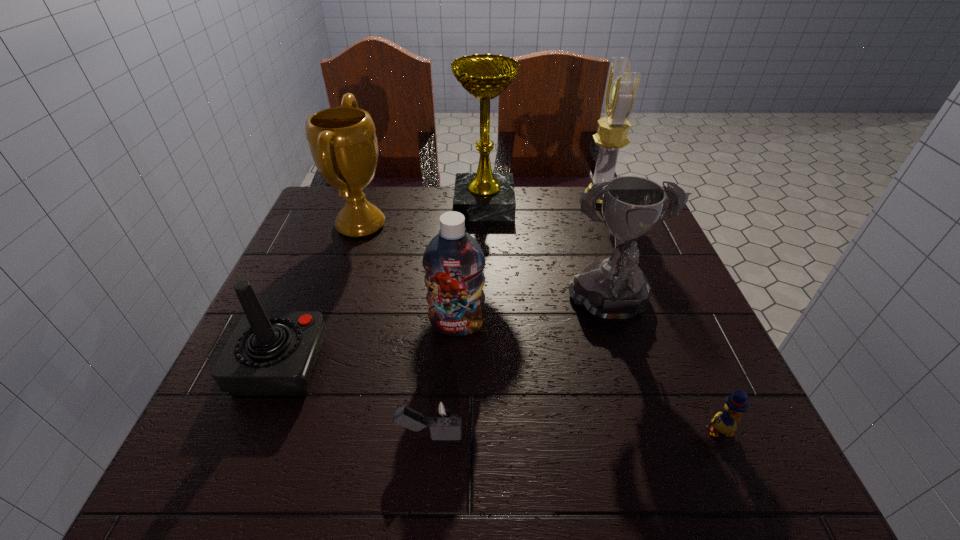
At what (x,y) coordinates should I click in order to perform the action: click on the third award from right to left. Please return your answer as a coordinate pair (x, y). Looking at the image, I should click on (483, 196).

What are the coordinates of `the leftmost award` in the screenshot? It's located at tap(342, 140).

At what (x,y) coordinates should I click in order to perform the action: click on the nearest award. Please return your answer as a coordinate pair (x, y). The image size is (960, 540). Looking at the image, I should click on pos(614,289).

I want to click on shampoo, so click(x=453, y=260).

Where is `the third shortest object`? This screenshot has width=960, height=540. the third shortest object is located at coordinates (270, 353).

This screenshot has height=540, width=960. Identify the location of igniter. (443, 417).

Image resolution: width=960 pixels, height=540 pixels. Identify the location of duckling. (725, 423).

At what (x,y) coordinates should I click in order to perform the action: click on vacant space located 0.150m on the front-facing side of the third award from right to left. Please return your answer as a coordinate pair (x, y). This screenshot has width=960, height=540. Looking at the image, I should click on (401, 204).

Locate an element on the screen. vacant space located on the front-facing side of the third award from right to left is located at coordinates (348, 204).

The height and width of the screenshot is (540, 960). In order to click on free space located 0.340m on the front-facing side of the third award from right to left in this screenshot , I will do `click(333, 204)`.